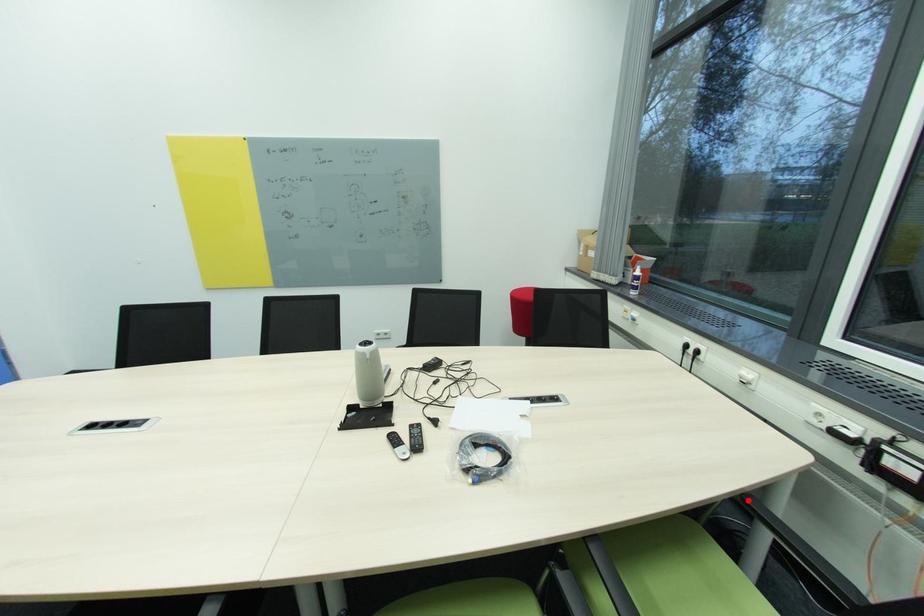
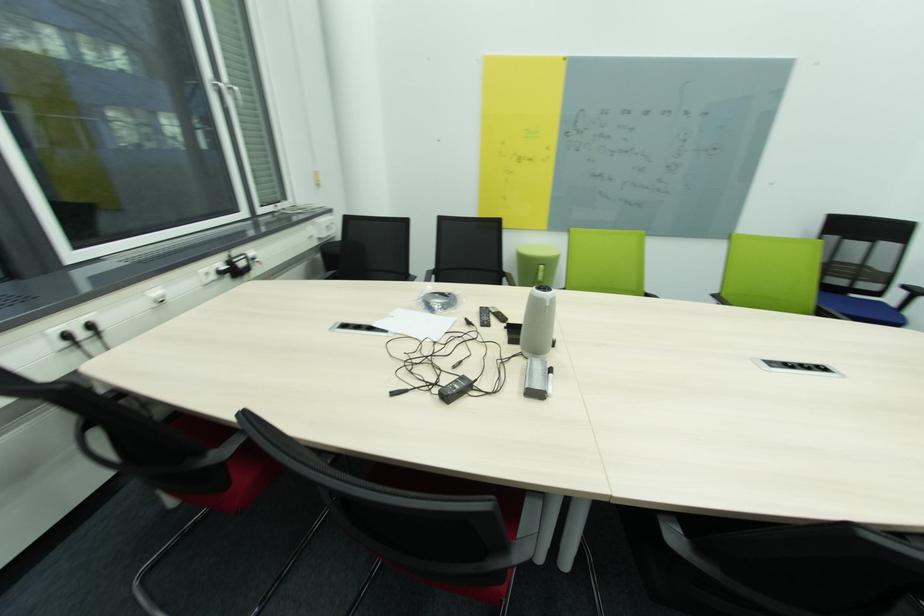
Question: I am providing you with two images of the same scene from different viewpoints. A red point is marked on the first image. At the location where the point appears in image 1, is it still visible in image 2?

Choices:
 (A) Yes
 (B) No

Answer: (B)